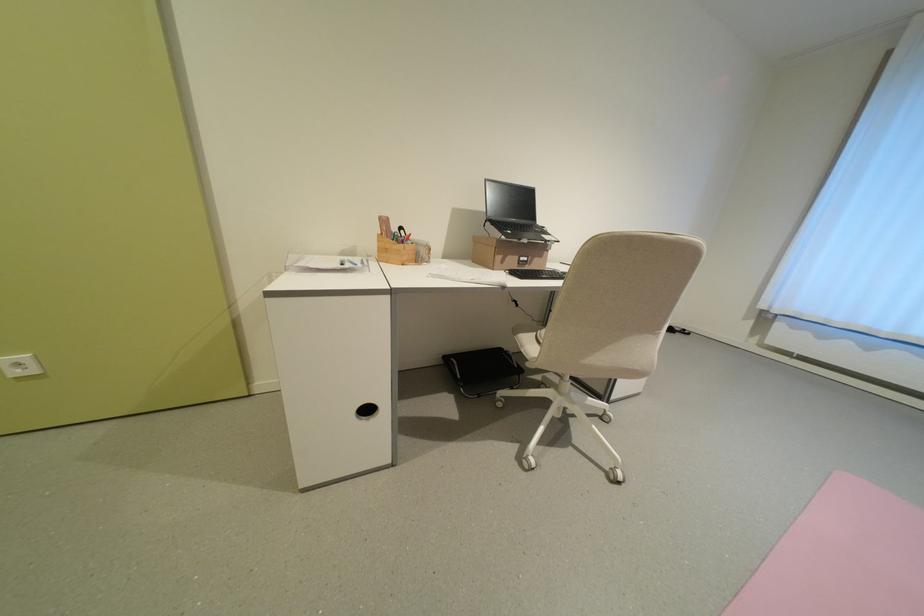
Locate an element on the screen. This screenshot has width=924, height=616. cardboard box is located at coordinates (507, 253).